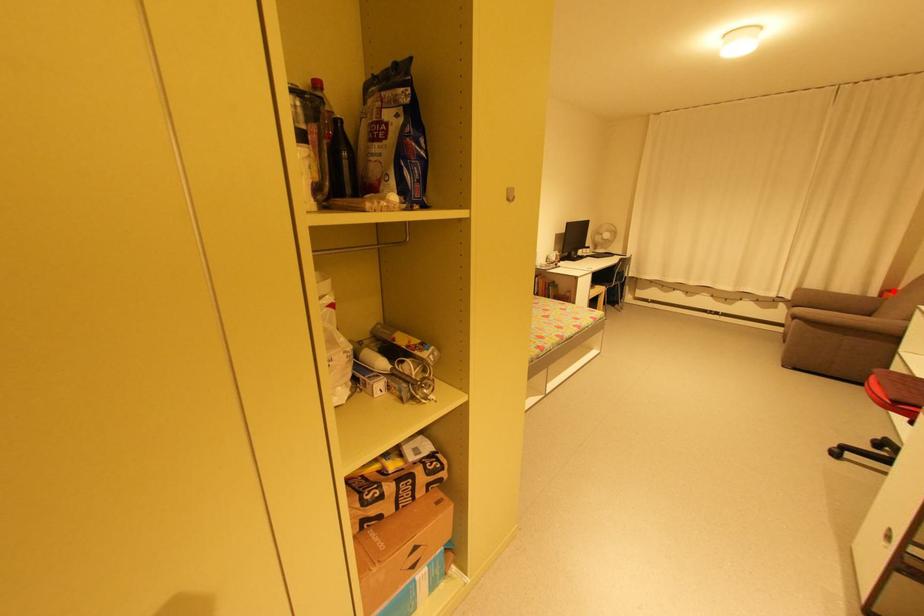
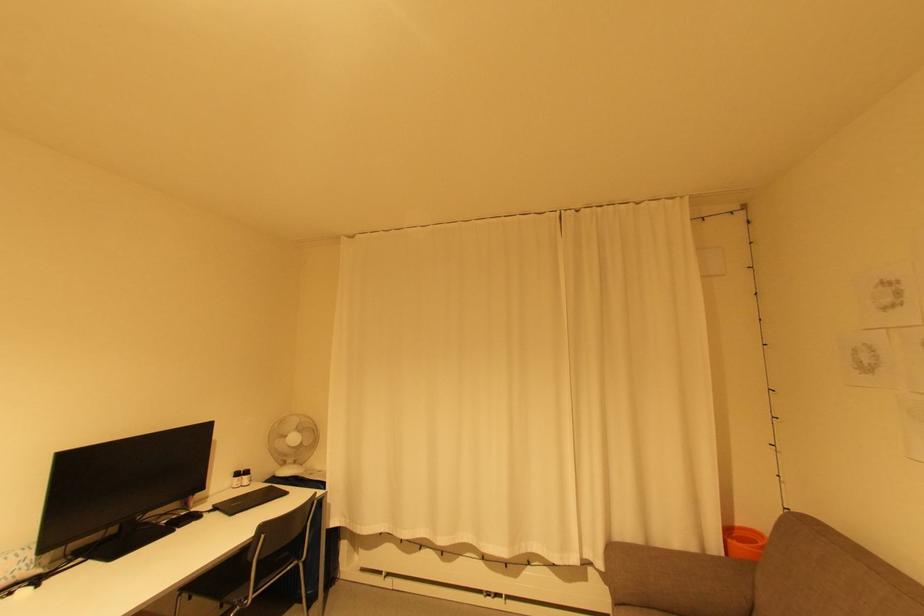
Where in the second image is the point corresponding to the highlighted location from the first image?

(733, 533)